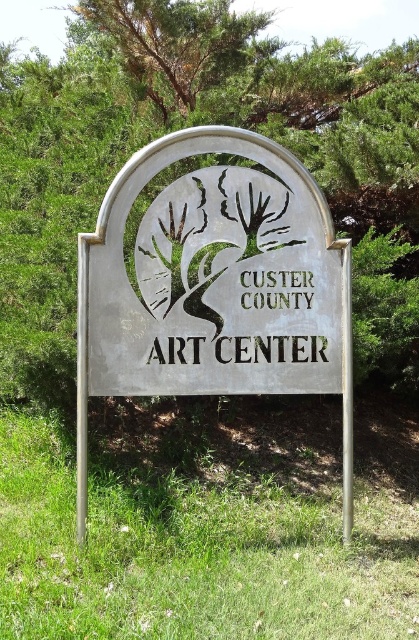
Locate an element on the screen. The height and width of the screenshot is (640, 419). metallic silver sign at center is located at coordinates (214, 285).

Measure the distance between metallic silver sign at center and camera.

metallic silver sign at center is 3.49 meters from camera.

Locate an element on the screen. The width and height of the screenshot is (419, 640). metallic silver sign at center is located at coordinates (214, 285).

Can you confirm if green grass at lower center is shorter than metallic silver sign at center?

Indeed, green grass at lower center has a lesser height compared to metallic silver sign at center.

Is point (372, 630) positioned behind point (80, 436)?

That is False.

Which is behind, point (230, 625) or point (118, 282)?

Positioned behind is point (118, 282).

This screenshot has height=640, width=419. I want to click on green grass at lower center, so click(193, 556).

Is point (15, 461) farther from camera compared to point (229, 0)?

No, it is in front of (229, 0).

Describe the element at coordinates (193, 556) in the screenshot. The image size is (419, 640). I see `green grass at lower center` at that location.

At what (x,y) coordinates should I click in order to perform the action: click on green grass at lower center. Please return your answer as a coordinate pair (x, y). This screenshot has height=640, width=419. Looking at the image, I should click on (193, 556).